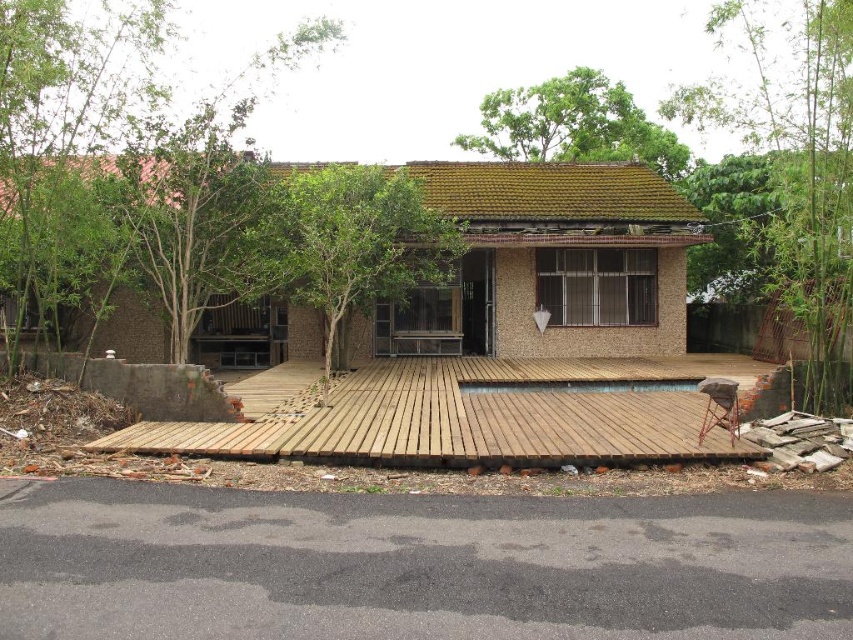
Between wooden deck at center and green leafy tree at upper center, which one is positioned higher?

green leafy tree at upper center is higher up.

Identify the location of wooden deck at center. The width and height of the screenshot is (853, 640). (477, 413).

From the picture: Can you confirm if green leafy tree at left is wider than green leafy tree at upper center?

Incorrect, green leafy tree at left's width does not surpass green leafy tree at upper center's.

Is green leafy tree at left behind green leafy tree at upper center?

No, green leafy tree at left is closer to the viewer.

Is point (28, 8) positioned after point (540, 92)?

No, (28, 8) is closer to viewer.

Where is `green leafy tree at left`? This screenshot has width=853, height=640. green leafy tree at left is located at coordinates (102, 164).

Between green leafy tree at left and wooden deck at center, which one has less height?

With less height is wooden deck at center.

Which is more to the right, green leafy tree at left or wooden deck at center?

wooden deck at center is more to the right.

Locate an element on the screen. This screenshot has width=853, height=640. green leafy tree at left is located at coordinates (102, 164).

Locate an element on the screen. green leafy tree at left is located at coordinates (102, 164).